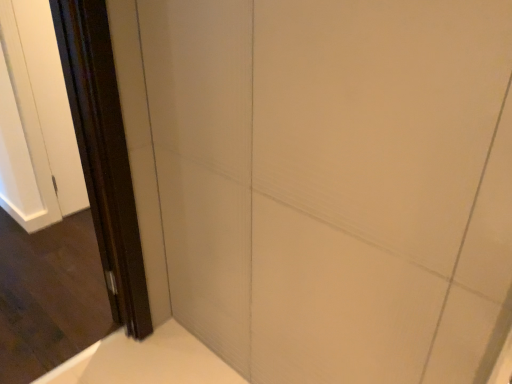
Question: Does dark brown wood screen door at left, the 2th screen door viewed from the back, have a larger size compared to dark brown wood screen door at left, which is the 2th screen door in front-to-back order?

Choices:
 (A) yes
 (B) no

Answer: (A)

Question: Could you tell me if dark brown wood screen door at left, the 2th screen door viewed from the back, is facing dark brown wood screen door at left, positioned as the first screen door in back-to-front order?

Choices:
 (A) yes
 (B) no

Answer: (B)

Question: Does dark brown wood screen door at left, which is the first screen door from front to back, come in front of dark brown wood screen door at left, which is the 2th screen door in front-to-back order?

Choices:
 (A) yes
 (B) no

Answer: (A)

Question: Is dark brown wood screen door at left, which is the first screen door from front to back, far away from dark brown wood screen door at left, positioned as the first screen door in back-to-front order?

Choices:
 (A) yes
 (B) no

Answer: (B)

Question: From the image's perspective, is dark brown wood screen door at left, the 2th screen door viewed from the back, above dark brown wood screen door at left, positioned as the first screen door in back-to-front order?

Choices:
 (A) no
 (B) yes

Answer: (A)

Question: Is dark brown wood screen door at left, the 2th screen door viewed from the back, positioned behind dark brown wood screen door at left, which is the 2th screen door in front-to-back order?

Choices:
 (A) no
 (B) yes

Answer: (A)

Question: Is the depth of dark brown wood screen door at left, positioned as the first screen door in back-to-front order, less than that of dark brown wood screen door at left, the 2th screen door viewed from the back?

Choices:
 (A) yes
 (B) no

Answer: (B)

Question: Is dark brown wood screen door at left, which is the 2th screen door in front-to-back order, bigger than dark brown wood screen door at left, which is the first screen door from front to back?

Choices:
 (A) yes
 (B) no

Answer: (B)

Question: Considering the relative sizes of dark brown wood screen door at left, which is the 2th screen door in front-to-back order, and dark brown wood screen door at left, the 2th screen door viewed from the back, in the image provided, is dark brown wood screen door at left, which is the 2th screen door in front-to-back order, taller than dark brown wood screen door at left, the 2th screen door viewed from the back,?

Choices:
 (A) yes
 (B) no

Answer: (B)

Question: Considering the relative sizes of dark brown wood screen door at left, which is the 2th screen door in front-to-back order, and dark brown wood screen door at left, which is the first screen door from front to back, in the image provided, is dark brown wood screen door at left, which is the 2th screen door in front-to-back order, smaller than dark brown wood screen door at left, which is the first screen door from front to back,?

Choices:
 (A) yes
 (B) no

Answer: (A)

Question: Is dark brown wood screen door at left, which is the 2th screen door in front-to-back order, behind dark brown wood screen door at left, the 2th screen door viewed from the back?

Choices:
 (A) yes
 (B) no

Answer: (A)

Question: Does dark brown wood screen door at left, which is the 2th screen door in front-to-back order, appear on the left side of dark brown wood screen door at left, which is the first screen door from front to back?

Choices:
 (A) no
 (B) yes

Answer: (A)

Question: From the image's perspective, relative to dark brown wood screen door at left, which is the 2th screen door in front-to-back order, is dark brown wood screen door at left, the 2th screen door viewed from the back, above or below?

Choices:
 (A) below
 (B) above

Answer: (A)